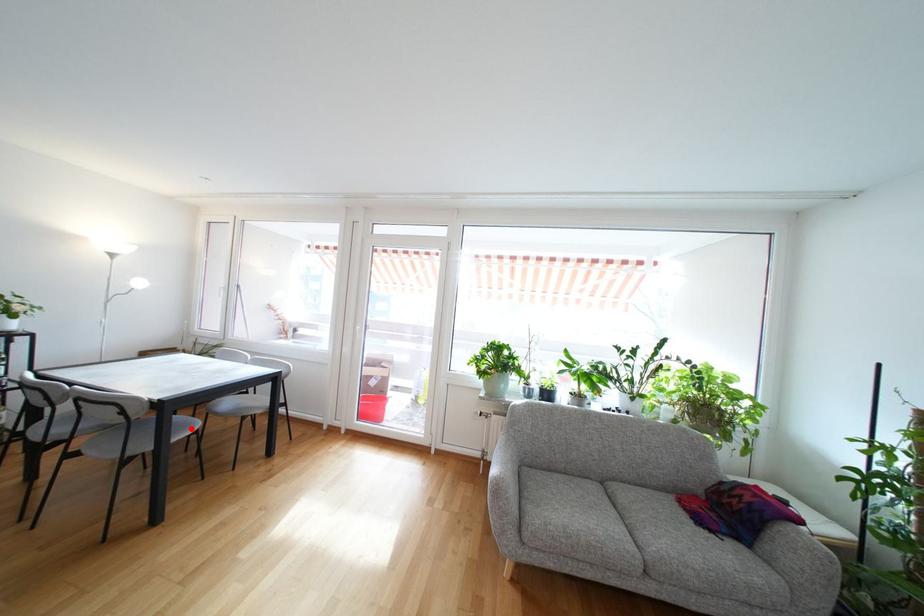
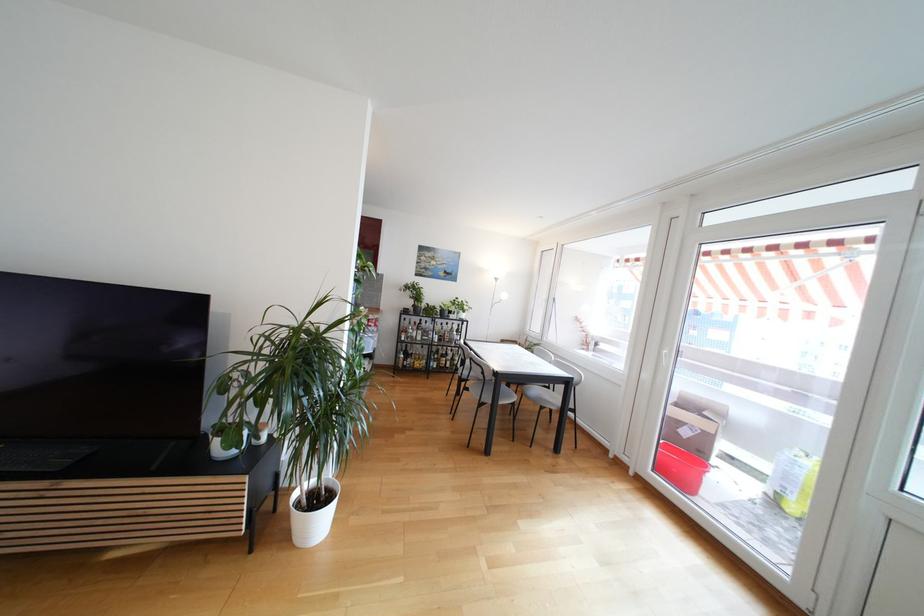
The point at the highlighted location is marked in the first image. Where is the corresponding point in the second image?

(513, 399)